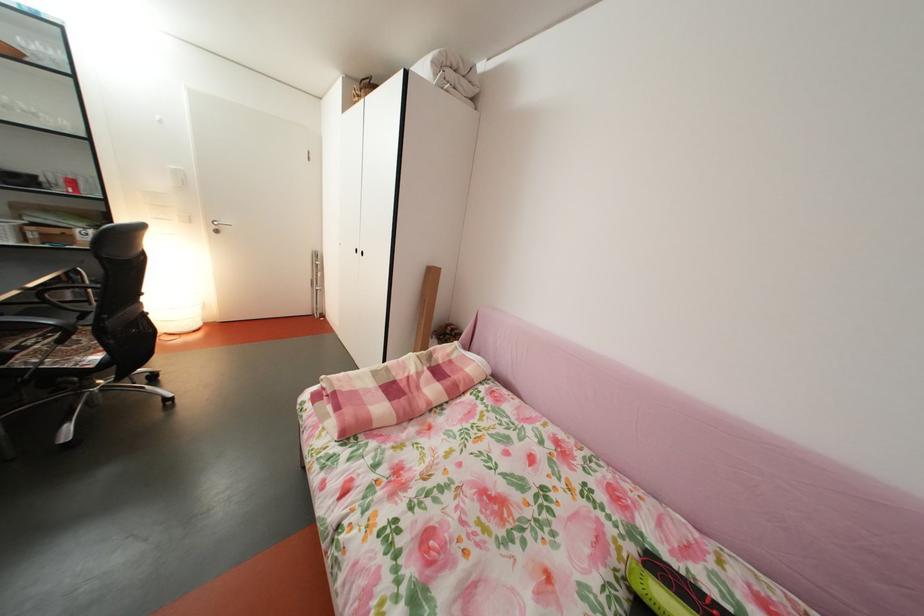
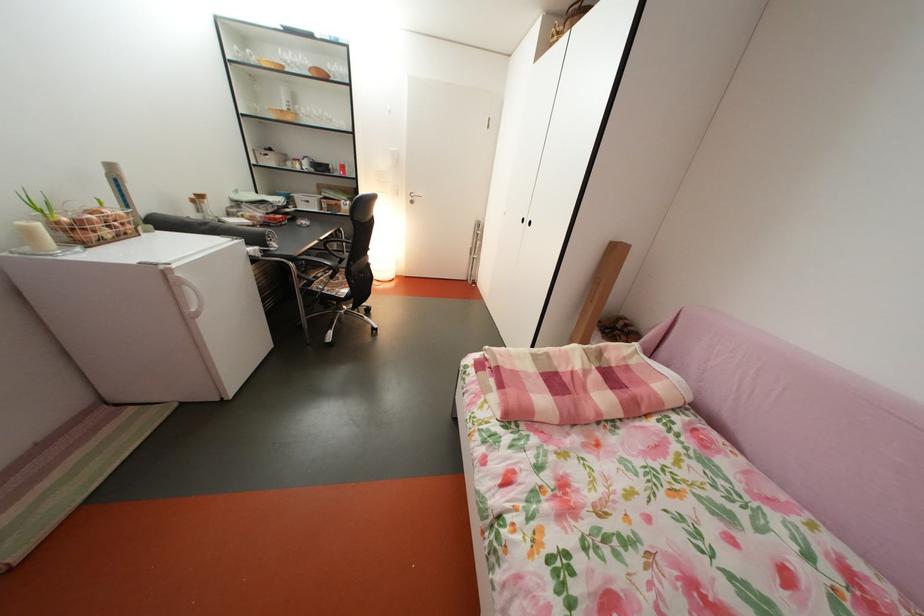
Where in the second image is the point corresponding to point (371, 257) from the first image?

(538, 228)